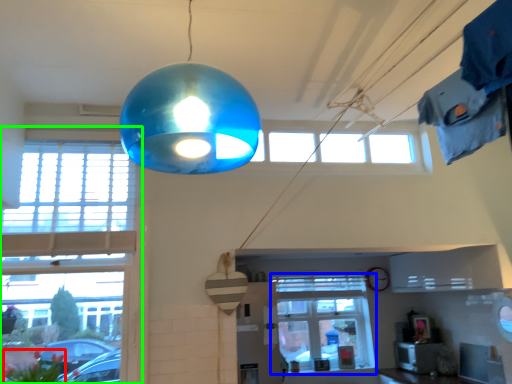
Question: Which is farther away from flower (highlighted by a red box)? window (highlighted by a blue box) or window (highlighted by a green box)?

Choices:
 (A) window
 (B) window

Answer: (A)